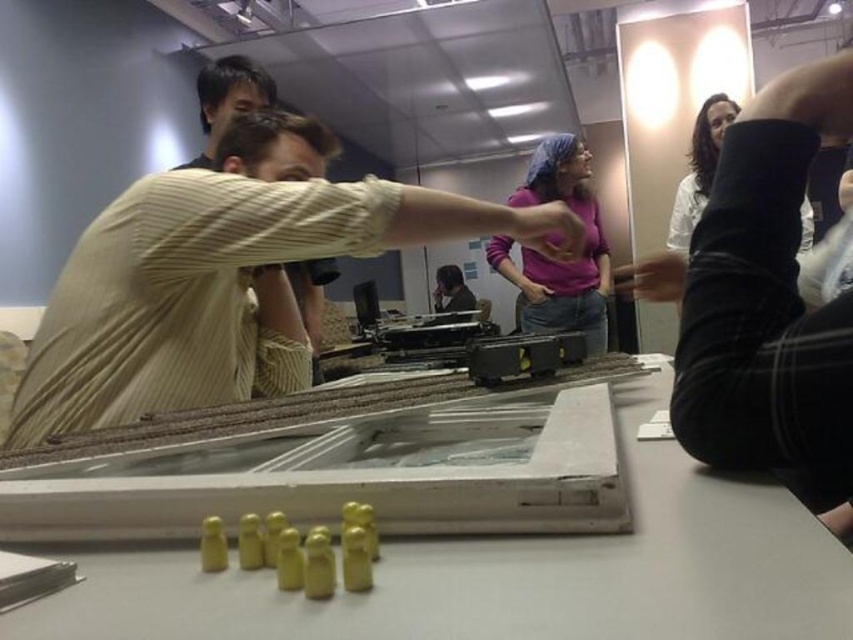
Question: Among these objects, which one is farthest from the camera?

Choices:
 (A) purple matte shirt at center
 (B) white matte table at center
 (C) light beige ribbed sweater at center

Answer: (A)

Question: Can you confirm if black leather boot at upper right is thinner than matte black shirt at center?

Choices:
 (A) no
 (B) yes

Answer: (B)

Question: Which point is closer to the camera taking this photo?

Choices:
 (A) (573, 138)
 (B) (656, 596)

Answer: (B)

Question: Is light beige ribbed sweater at center below matte black shirt at center?

Choices:
 (A) yes
 (B) no

Answer: (A)

Question: Does light beige ribbed sweater at center have a smaller size compared to black knit sweater at upper right?

Choices:
 (A) no
 (B) yes

Answer: (A)

Question: Which of the following is the closest to the observer?

Choices:
 (A) pyautogui.click(x=698, y=160)
 (B) pyautogui.click(x=138, y=560)

Answer: (B)